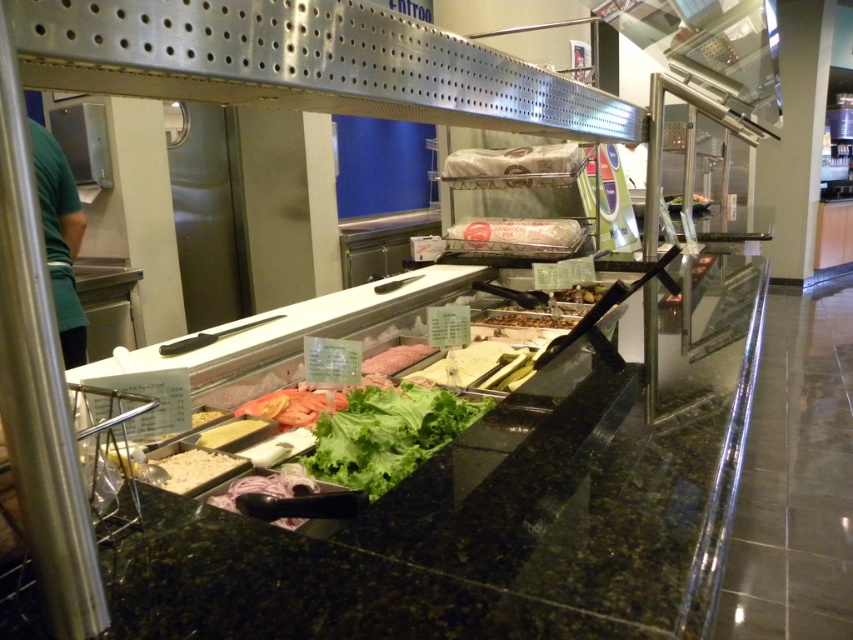
Question: Which of the following is the farthest from the observer?

Choices:
 (A) brown crumbly topping at center
 (B) green leafy lettuce at center

Answer: (A)

Question: In this image, where is purple translucent onions at center located relative to slightly yellowish matte cheese at center?

Choices:
 (A) above
 (B) below

Answer: (B)

Question: Among these points, which one is nearest to the camera?

Choices:
 (A) (527, 321)
 (B) (383, 372)
 (C) (434, 387)
 (D) (212, 413)

Answer: (D)

Question: Based on their relative distances, which object is nearer to the purple translucent onions at center?

Choices:
 (A) green fabric shirt at left
 (B) slightly yellowish matte cheese at center

Answer: (B)

Question: Is tomato slice at center positioned at the back of semi-translucent pink meat at center?

Choices:
 (A) no
 (B) yes

Answer: (A)

Question: Does purple translucent onions at center appear over yellow cheese at center?

Choices:
 (A) yes
 (B) no

Answer: (B)